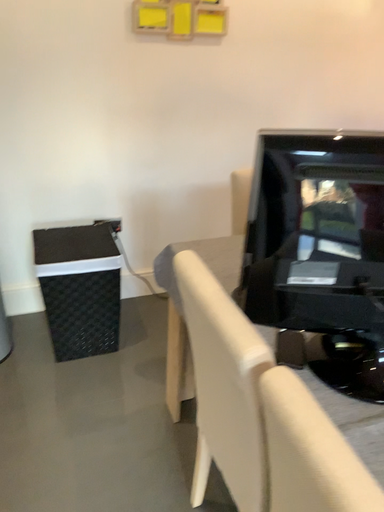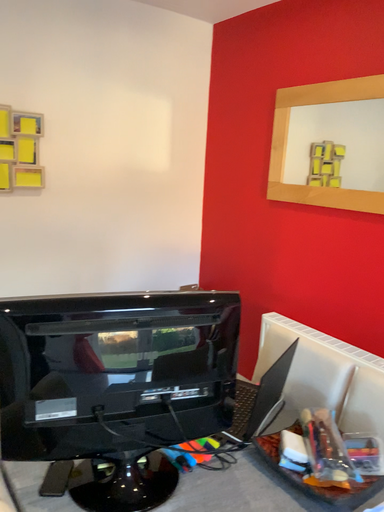
Question: How did the camera likely rotate when shooting the video?

Choices:
 (A) rotated right
 (B) rotated left

Answer: (A)